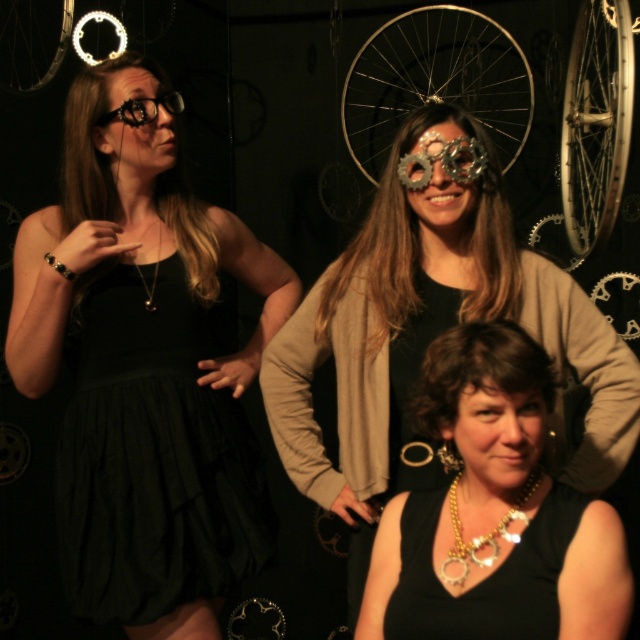
Is silver metallic bicycle wheel at center bigger than matte black glasses at upper left?

Indeed, silver metallic bicycle wheel at center has a larger size compared to matte black glasses at upper left.

Is point (440, 97) closer to viewer compared to point (157, 129)?

No, it is behind (157, 129).

Is point (371, 131) closer to camera compared to point (140, 115)?

That is False.

Locate an element on the screen. silver metallic bicycle wheel at center is located at coordinates (435, 81).

In the scene shown: Is gold metallic bicycle wheel at upper right shorter than metallic gear at center?

In fact, gold metallic bicycle wheel at upper right may be taller than metallic gear at center.

Who is taller, gold metallic bicycle wheel at upper right or metallic gear at center?

gold metallic bicycle wheel at upper right

Between point (580, 129) and point (468, 160), which one is positioned behind?

Point (580, 129)

The width and height of the screenshot is (640, 640). I want to click on gold metallic bicycle wheel at upper right, so click(596, 122).

Can you confirm if silver metallic bicycle wheel at center is positioned below gold chain necklace at center?

Actually, silver metallic bicycle wheel at center is above gold chain necklace at center.

Does silver metallic bicycle wheel at center have a lesser height compared to gold chain necklace at center?

No, silver metallic bicycle wheel at center is not shorter than gold chain necklace at center.

Locate an element on the screen. The width and height of the screenshot is (640, 640). silver metallic bicycle wheel at center is located at coordinates (435, 81).

Locate an element on the screen. The height and width of the screenshot is (640, 640). silver metallic bicycle wheel at center is located at coordinates (435, 81).